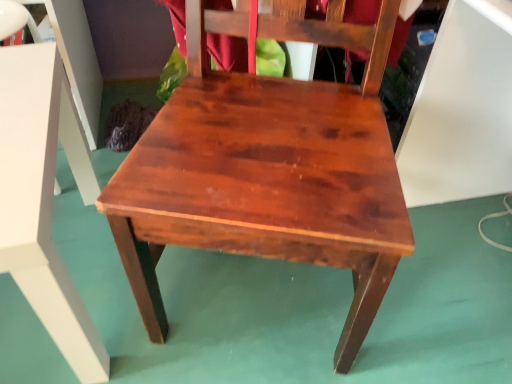
Locate an element on the screen. This screenshot has height=384, width=512. free area below satin wood chair at center (from a real-world perspective) is located at coordinates (265, 295).